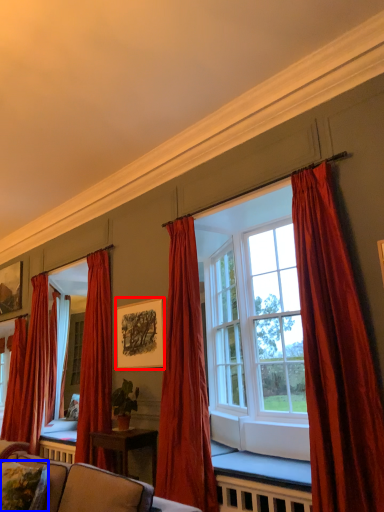
Question: Which object appears farthest to the camera in this image, picture frame (highlighted by a red box) or pillow (highlighted by a blue box)?

Choices:
 (A) picture frame
 (B) pillow

Answer: (A)